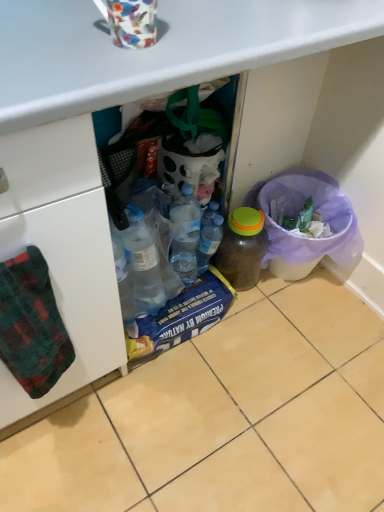
Where is `vacant area on top of beige tile at lower center (from a real-world perspective)`? This screenshot has height=512, width=384. vacant area on top of beige tile at lower center (from a real-world perspective) is located at coordinates (233, 403).